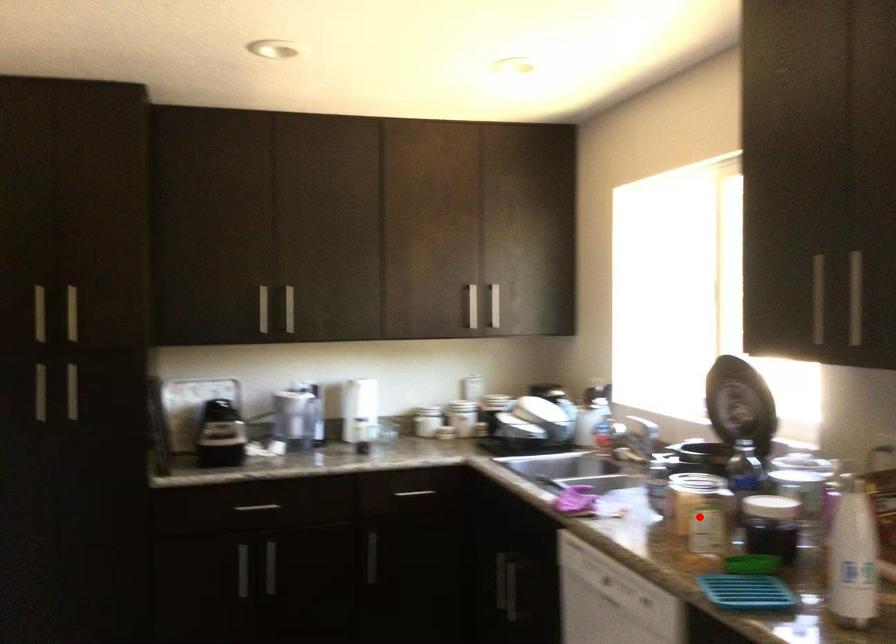
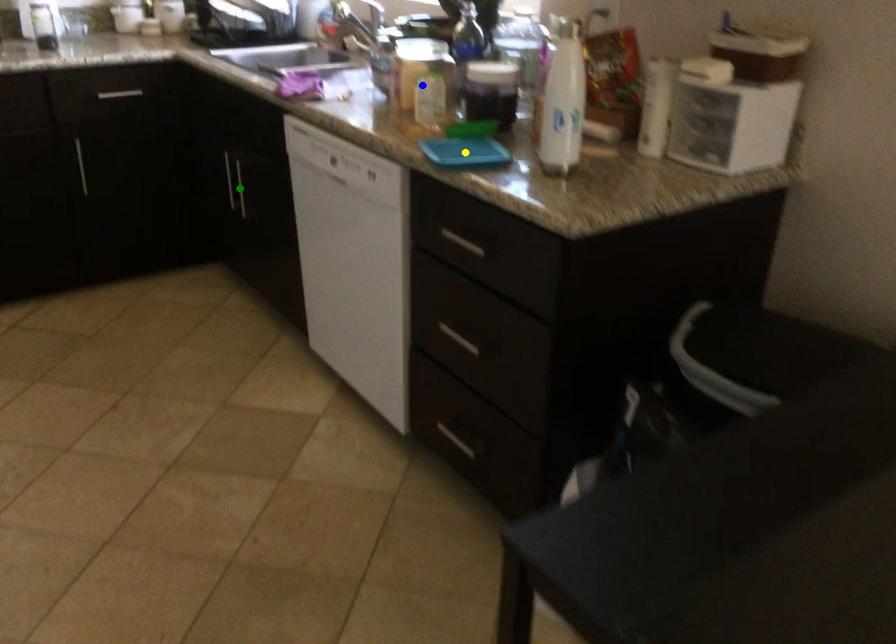
Question: I am providing you with two images of the same scene from different viewpoints. A red point is marked on the first image. You are given multiple points on the second image. Which point in image 2 represents the same 3d spot as the red point in image 1?

Choices:
 (A) yellow point
 (B) blue point
 (C) green point

Answer: (B)